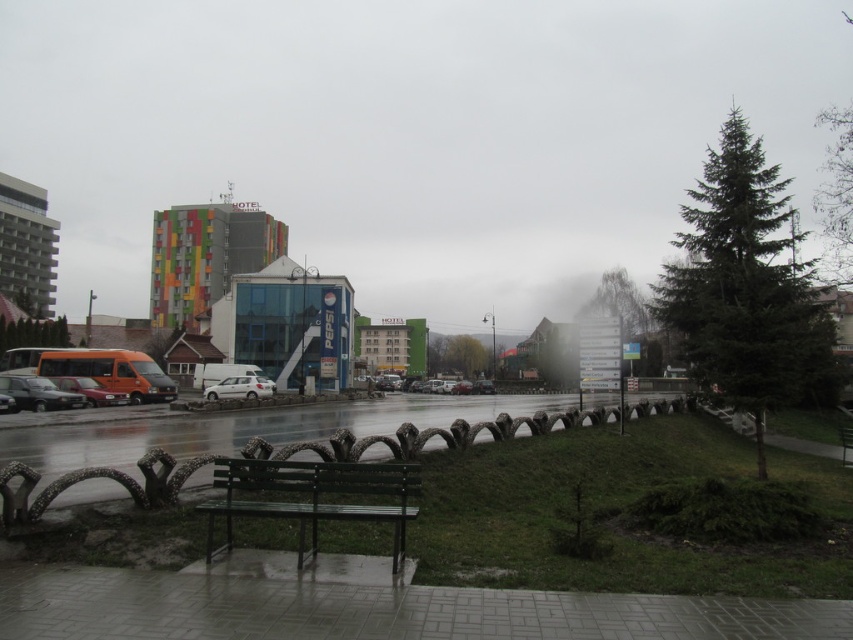
Looking at this image, you are standing on the grassy area in the midground and want to sit down. Which object, the green matte bench at lower center or the white matte car at center, is more suitable for sitting?

The green matte bench at lower center is more suitable for sitting because it is designed for seating, whereas the white matte car at center is meant for transportation and not for sitting.